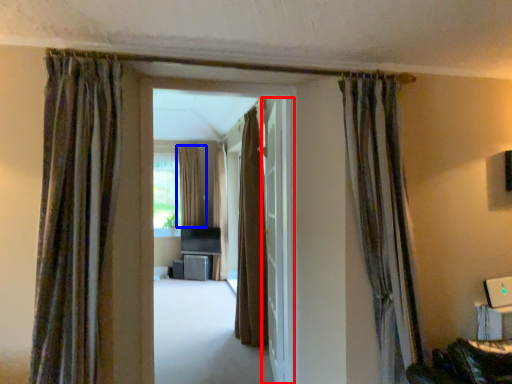
Question: Which of the following is the closest to the observer, door (highlighted by a red box) or curtain (highlighted by a blue box)?

Choices:
 (A) door
 (B) curtain

Answer: (A)